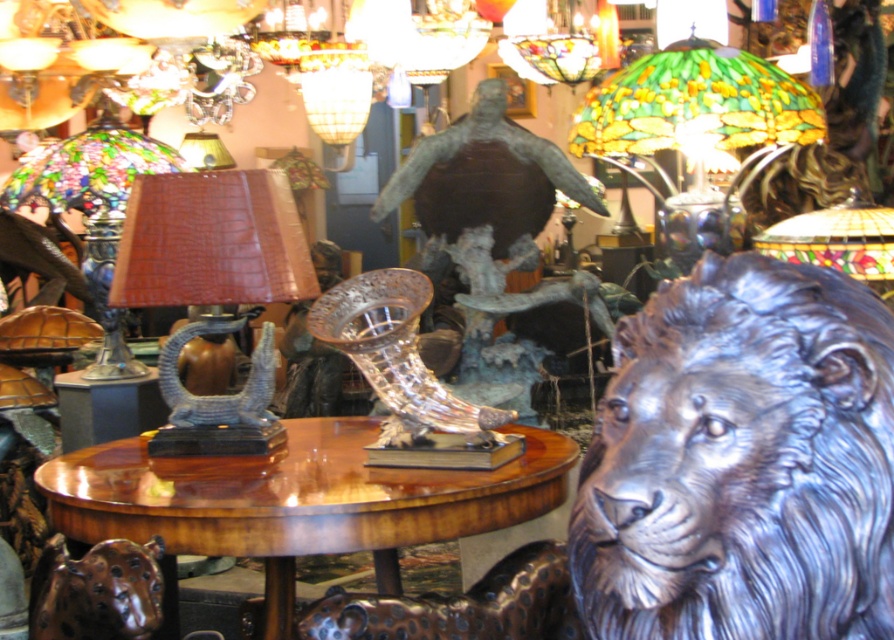
You are standing in the room and want to determine which of the two points, point (209, 468) or point (97, 257), is nearer to you. Based on the scene description, which point is closer?

Point (209, 468) is closer to the viewer than point (97, 257).

You are an interior designer planning to place a 1.5 meter long sofa between the shiny wood table at center and the brown leather lampshade at left. Is there enough space for the sofa?

The distance between the shiny wood table at center and the brown leather lampshade at left is 1.22 meters. Since the sofa is 1.5 meters long, it would not fit in the available space.

You are an interior designer arranging items on a table. You have a shiny silver lion head at center and a brown leather lamp at center. Which object is positioned lower on the table?

The shiny silver lion head at center is located below the brown leather lamp at center, so it is positioned lower on the table.